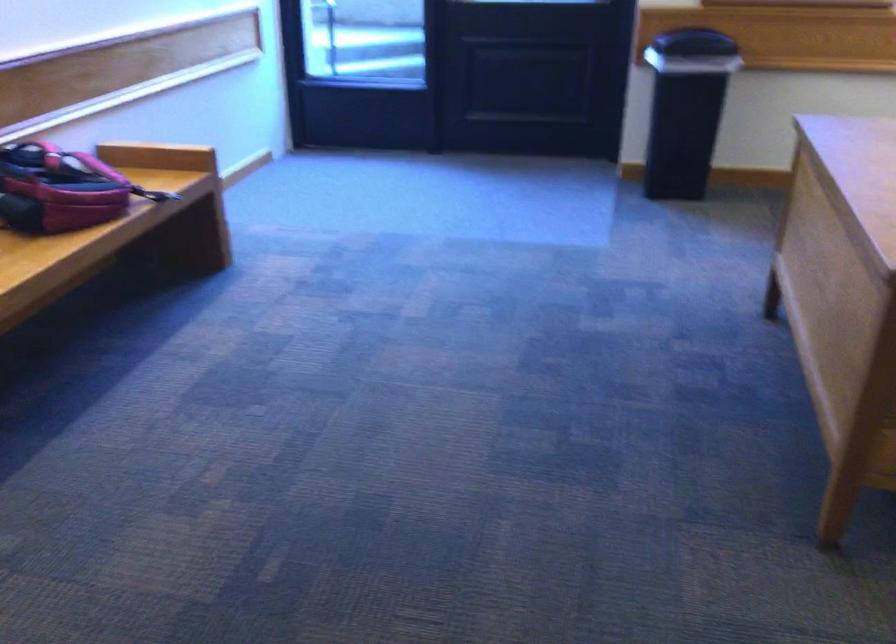
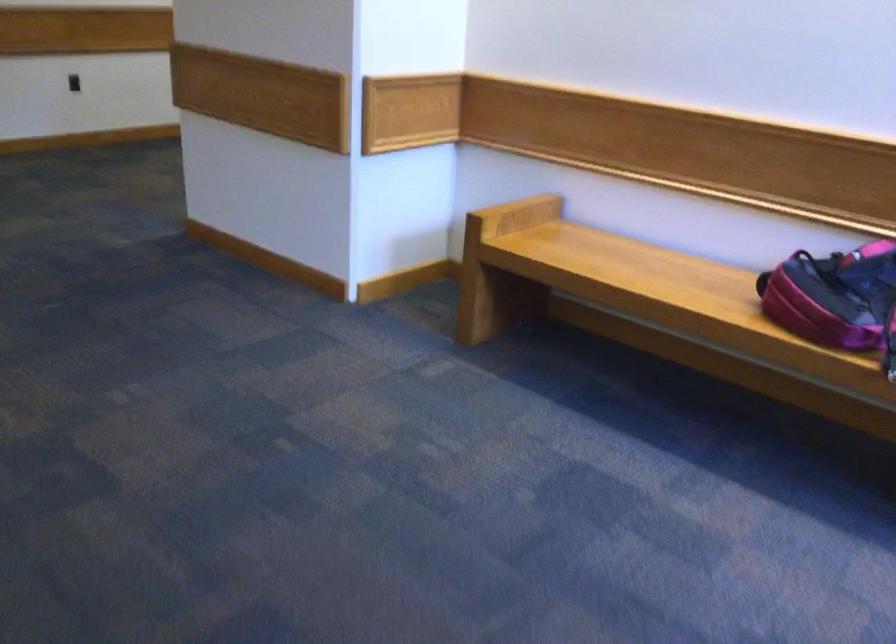
Where in the second image is the point corresponding to [88,178] from the first image?

(833, 296)